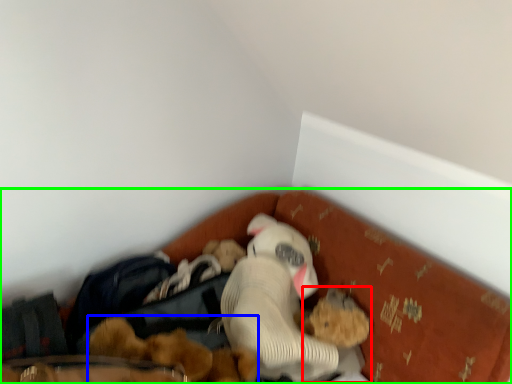
Question: Which is farther away from toy (highlighted by a red box)? toy (highlighted by a blue box) or bed (highlighted by a green box)?

Choices:
 (A) toy
 (B) bed

Answer: (B)